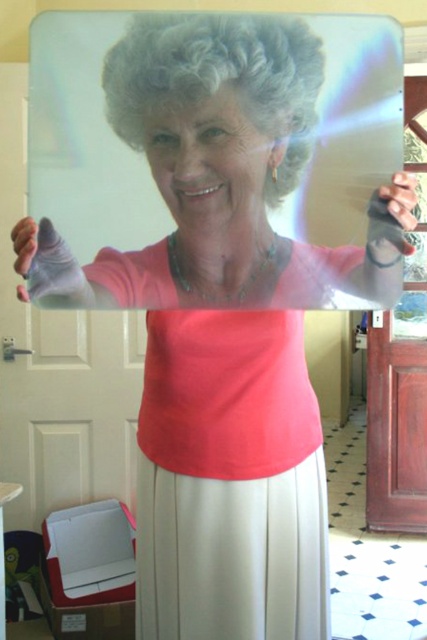
Question: Which of the following is the closest to the observer?

Choices:
 (A) (35, 289)
 (B) (143, 51)
 (C) (376, 234)

Answer: (B)

Question: Does curly gray wig at upper center appear over matte black glove at upper right?

Choices:
 (A) no
 (B) yes

Answer: (B)

Question: Which object is farther from the camera taking this photo?

Choices:
 (A) matte pink glove at left
 (B) curly gray wig at upper center

Answer: (A)

Question: Is matte pink glove at left smaller than matte black glove at upper right?

Choices:
 (A) no
 (B) yes

Answer: (A)

Question: Does curly gray wig at upper center appear over matte black glove at upper right?

Choices:
 (A) yes
 (B) no

Answer: (A)

Question: Which point is farther to the camera?

Choices:
 (A) matte pink glove at left
 (B) curly gray wig at upper center
 (C) matte black glove at upper right

Answer: (A)